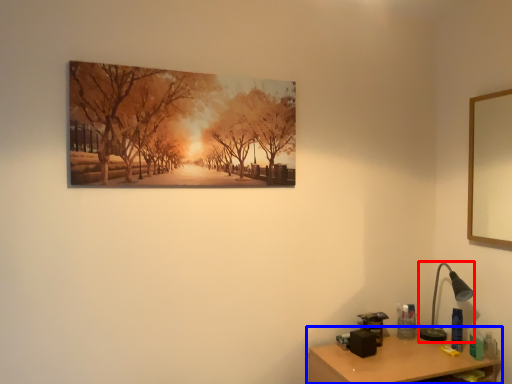
Question: Which point is further to the camera, table lamp (highlighted by a red box) or table (highlighted by a blue box)?

Choices:
 (A) table lamp
 (B) table

Answer: (A)